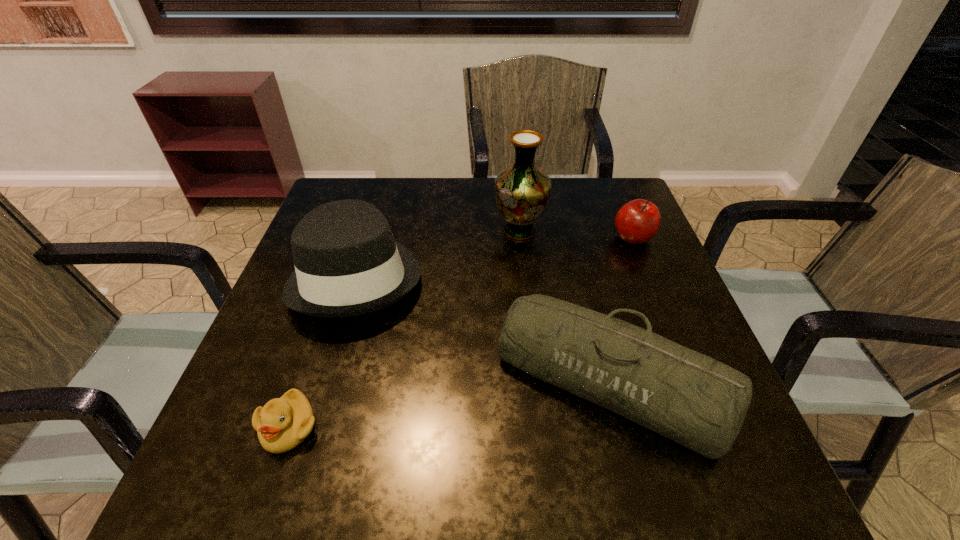
The height and width of the screenshot is (540, 960). I want to click on object at the near right corner, so click(x=688, y=397).

In the image, there is a desktop. Where is `vacant space at the far edge`? vacant space at the far edge is located at coordinates (395, 188).

At what (x,y) coordinates should I click in order to perform the action: click on vacant space at the near edge of the desktop. Please return your answer as a coordinate pair (x, y). Image resolution: width=960 pixels, height=540 pixels. Looking at the image, I should click on pyautogui.click(x=431, y=476).

At what (x,y) coordinates should I click in order to perform the action: click on free space at the left edge. Please return your answer as a coordinate pair (x, y). Looking at the image, I should click on (274, 346).

Find the location of `vacant space at the right edge of the desktop`. vacant space at the right edge of the desktop is located at coordinates (x=636, y=275).

The height and width of the screenshot is (540, 960). What are the coordinates of `vacant area at the far right corner of the desktop` in the screenshot? It's located at (600, 180).

Find the location of a particular element. The width and height of the screenshot is (960, 540). free space between the tallest object and the apple is located at coordinates (576, 234).

Identify the location of vacant point located between the fedora and the apple. (494, 257).

Where is `empty space between the vase and the apple`? empty space between the vase and the apple is located at coordinates (576, 234).

This screenshot has height=540, width=960. I want to click on vacant space that's between the apple and the duckling, so click(461, 333).